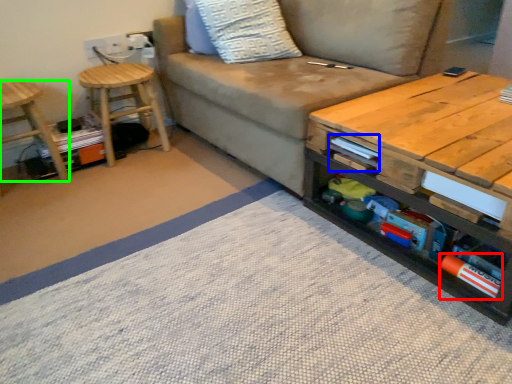
Question: Estimate the real-world distances between objects in this image. Which object is farther from book (highlighted by a red box), book (highlighted by a blue box) or stool (highlighted by a green box)?

Choices:
 (A) book
 (B) stool

Answer: (B)